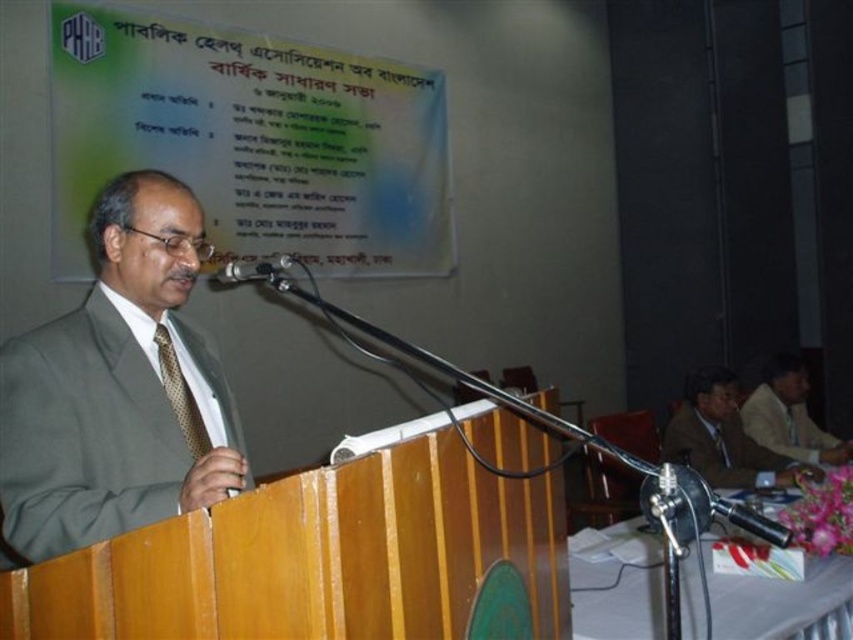
Question: Is light brown suit at right positioned before brown textured tie at center?

Choices:
 (A) no
 (B) yes

Answer: (A)

Question: Among these objects, which one is farthest from the camera?

Choices:
 (A) brown textured tie at center
 (B) matte green suit at center

Answer: (A)

Question: Is the position of gold textured tie at left more distant than that of metallic silver microphone at center?

Choices:
 (A) yes
 (B) no

Answer: (A)

Question: Which object appears farthest from the camera in this image?

Choices:
 (A) light brown suit at right
 (B) matte green suit at center
 (C) brown textured tie at center

Answer: (A)

Question: Based on their relative distances, which object is farther from the gold textured tie at left?

Choices:
 (A) brown textured tie at center
 (B) matte green suit at center

Answer: (A)

Question: Is light brown suit at lower right below brown textured tie at center?

Choices:
 (A) yes
 (B) no

Answer: (B)